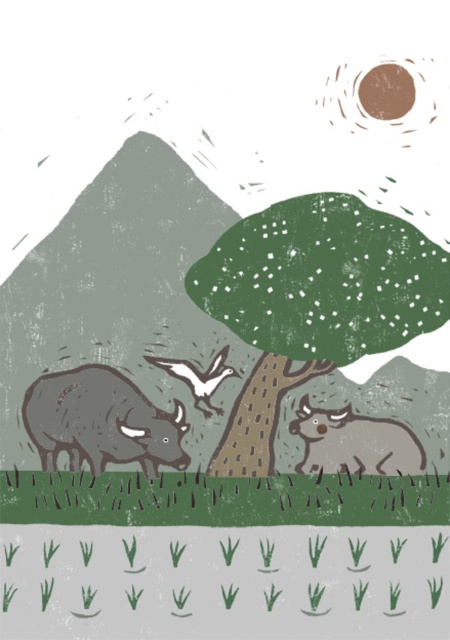
Question: Which point is farther to the camera?

Choices:
 (A) (169, 371)
 (B) (121, 472)
 (C) (79, 369)

Answer: (A)

Question: Can you confirm if green textured grass at lower center is positioned below white matte bird at center?

Choices:
 (A) yes
 (B) no

Answer: (A)

Question: Where is green textured grass at lower center located in relation to white matte bird at center in the image?

Choices:
 (A) above
 (B) below

Answer: (B)

Question: Among these points, which one is nearest to the camera?

Choices:
 (A) (361, 513)
 (B) (106, 433)
 (C) (382, 444)
 (D) (175, 360)

Answer: (A)

Question: Is gray textured cow at center above gray textured cow at lower right?

Choices:
 (A) no
 (B) yes

Answer: (B)

Question: Which of the following is the closest to the observer?

Choices:
 (A) (112, 385)
 (B) (4, 497)

Answer: (B)